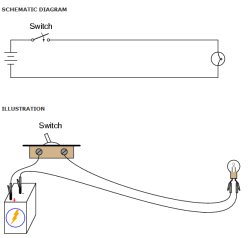
The height and width of the screenshot is (238, 250). I want to click on box, so 21,195, 16,203, 27,206, 21,230.